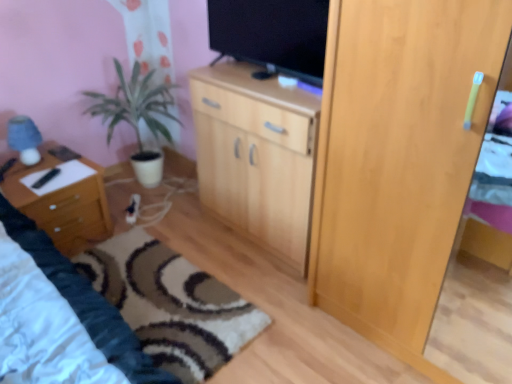
The image size is (512, 384). What are the coordinates of `free point behind carpet with swirl pattern at lower center` in the screenshot? It's located at (177, 221).